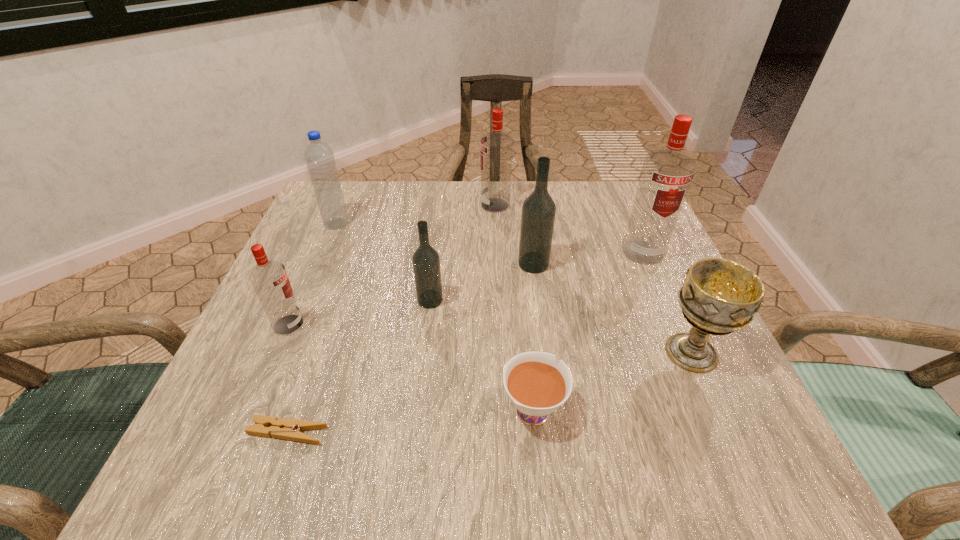
Where is `free space that satisfies the following two spatial constraints: 1. on the front side of the nearer black vodka; 2. on the front label of the leftmost red vodka`? Image resolution: width=960 pixels, height=540 pixels. free space that satisfies the following two spatial constraints: 1. on the front side of the nearer black vodka; 2. on the front label of the leftmost red vodka is located at coordinates (427, 325).